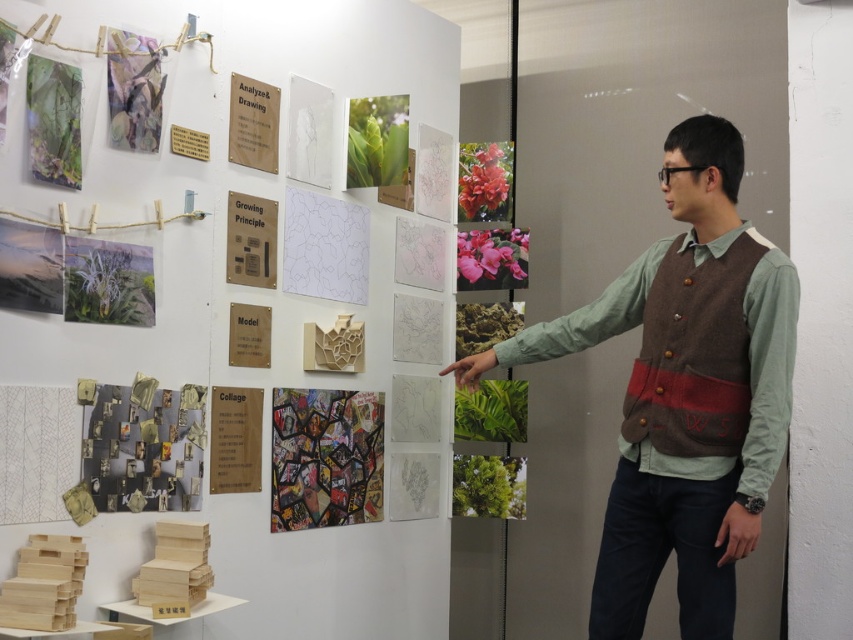
Can you confirm if green matte paper at left is taller than green matte plant at center?

No, green matte paper at left is not taller than green matte plant at center.

Can you confirm if green matte paper at left is thinner than green matte plant at center?

Indeed, green matte paper at left has a lesser width compared to green matte plant at center.

Is point (148, 269) less distant than point (473, 410)?

That is True.

You are a GUI agent. You are given a task and a screenshot of the screen. Output one action in this format:
    pyautogui.click(x=<x>, y=<y>)
    Task: Click on the green matte paper at left
    Image resolution: width=853 pixels, height=640 pixels.
    Given the screenshot: What is the action you would take?
    pyautogui.click(x=108, y=282)

Is green matte plant at lower center closer to camera compared to vivid pink petals at upper right?

Yes, green matte plant at lower center is closer to the viewer.

Is green matte plant at lower center taller than vivid pink petals at upper right?

In fact, green matte plant at lower center may be shorter than vivid pink petals at upper right.

Image resolution: width=853 pixels, height=640 pixels. Find the location of `green matte plant at lower center`. green matte plant at lower center is located at coordinates (488, 484).

Locate an element on the screen. The width and height of the screenshot is (853, 640). green matte plant at lower center is located at coordinates (488, 484).

Consider the image. Which is more to the left, green leafy plant at upper left or matte paper collage at upper left?

Positioned to the left is green leafy plant at upper left.

In the scene shown: Does green leafy plant at upper left have a greater width compared to matte paper collage at upper left?

No, green leafy plant at upper left is not wider than matte paper collage at upper left.

Which is behind, point (39, 81) or point (155, 67)?

Positioned behind is point (155, 67).

The width and height of the screenshot is (853, 640). Find the location of `green leafy plant at upper left`. green leafy plant at upper left is located at coordinates point(53,122).